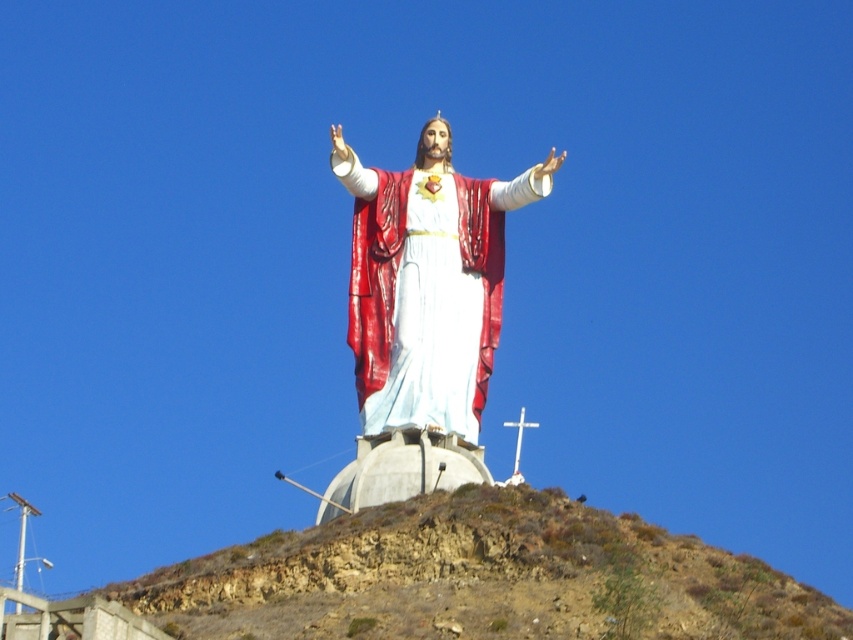
Question: Can you confirm if brown rocky hillside at center is smaller than shiny red fabric at center?

Choices:
 (A) yes
 (B) no

Answer: (B)

Question: Which object is farther from the camera taking this photo?

Choices:
 (A) shiny red fabric at center
 (B) brown rocky hillside at center

Answer: (A)

Question: Observing the image, what is the correct spatial positioning of brown rocky hillside at center in reference to shiny red fabric at center?

Choices:
 (A) below
 (B) above

Answer: (A)

Question: Considering the relative positions of brown rocky hillside at center and shiny red fabric at center in the image provided, where is brown rocky hillside at center located with respect to shiny red fabric at center?

Choices:
 (A) left
 (B) right

Answer: (B)

Question: Which point is farther to the camera?

Choices:
 (A) (432, 344)
 (B) (303, 529)

Answer: (B)